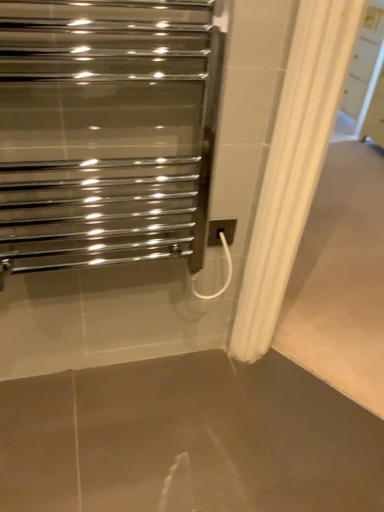
Question: From a real-world perspective, is polished chrome towel warmer at upper left under white plastic electric outlet at center-right?

Choices:
 (A) no
 (B) yes

Answer: (A)

Question: Are polished chrome towel warmer at upper left and white plastic electric outlet at center-right beside each other?

Choices:
 (A) yes
 (B) no

Answer: (B)

Question: Is polished chrome towel warmer at upper left thinner than white plastic electric outlet at center-right?

Choices:
 (A) yes
 (B) no

Answer: (B)

Question: Are polished chrome towel warmer at upper left and white plastic electric outlet at center-right far apart?

Choices:
 (A) no
 (B) yes

Answer: (A)

Question: Is polished chrome towel warmer at upper left oriented towards white plastic electric outlet at center-right?

Choices:
 (A) yes
 (B) no

Answer: (B)

Question: Considering the positions of polished chrome towel warmer at upper left and white plastic electric outlet at center-right in the image, is polished chrome towel warmer at upper left taller or shorter than white plastic electric outlet at center-right?

Choices:
 (A) short
 (B) tall

Answer: (B)

Question: Considering their positions, is polished chrome towel warmer at upper left located in front of or behind white plastic electric outlet at center-right?

Choices:
 (A) front
 (B) behind

Answer: (A)

Question: Based on their positions, is polished chrome towel warmer at upper left located to the left or right of white plastic electric outlet at center-right?

Choices:
 (A) left
 (B) right

Answer: (A)

Question: Is polished chrome towel warmer at upper left wider or thinner than white plastic electric outlet at center-right?

Choices:
 (A) thin
 (B) wide

Answer: (B)

Question: Relative to brown polished concrete at center, is white plastic electric outlet at center-right in front or behind?

Choices:
 (A) behind
 (B) front

Answer: (A)

Question: Is white plastic electric outlet at center-right wider or thinner than brown polished concrete at center?

Choices:
 (A) thin
 (B) wide

Answer: (A)

Question: Would you say white plastic electric outlet at center-right is inside or outside brown polished concrete at center?

Choices:
 (A) inside
 (B) outside

Answer: (B)

Question: Is white plastic electric outlet at center-right to the left or to the right of brown polished concrete at center in the image?

Choices:
 (A) right
 (B) left

Answer: (B)

Question: Relative to white plastic electric outlet at center-right, is brown polished concrete at center in front or behind?

Choices:
 (A) front
 (B) behind

Answer: (A)

Question: Is brown polished concrete at center situated inside white plastic electric outlet at center-right or outside?

Choices:
 (A) outside
 (B) inside

Answer: (A)